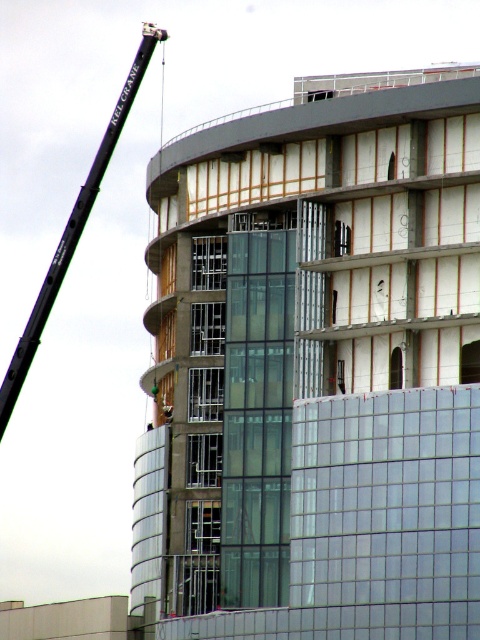
Question: Among these points, which one is farthest from the camera?

Choices:
 (A) (334, 308)
 (B) (131, 88)

Answer: (B)

Question: Does clear glass building at center appear on the right side of black metal crane at upper left?

Choices:
 (A) no
 (B) yes

Answer: (B)

Question: Is clear glass building at center positioned behind black metal crane at upper left?

Choices:
 (A) no
 (B) yes

Answer: (A)

Question: Can you confirm if clear glass building at center is wider than black metal crane at upper left?

Choices:
 (A) no
 (B) yes

Answer: (A)